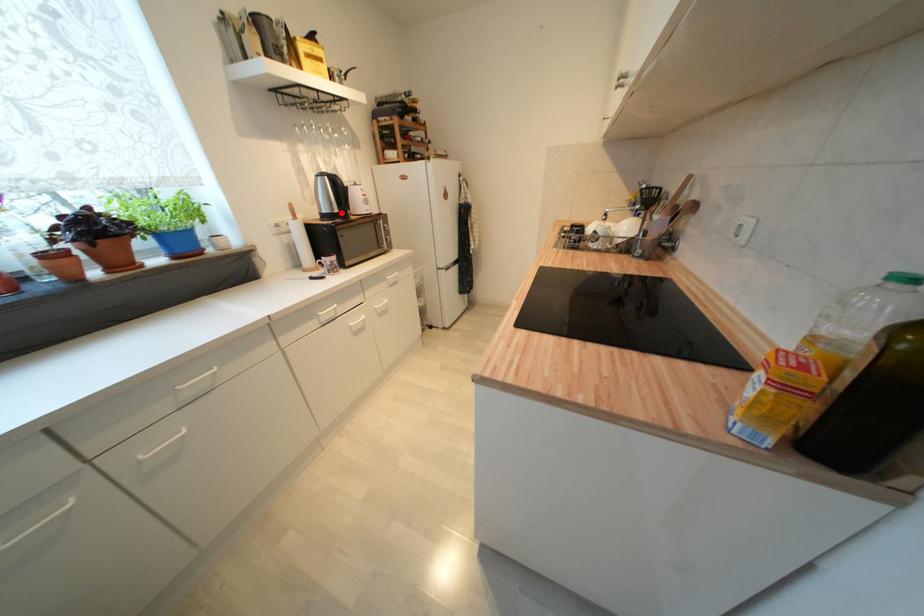
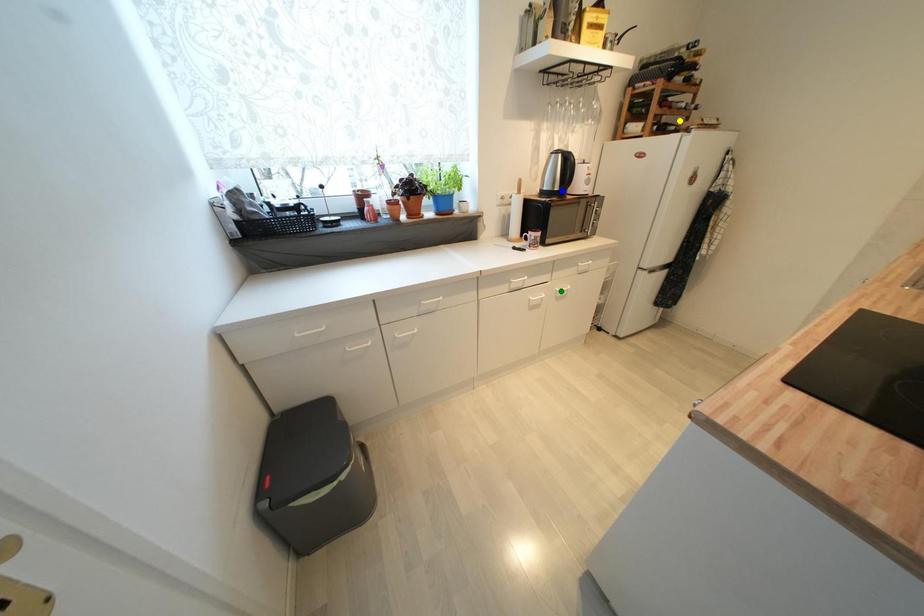
Question: I am providing you with two images of the same scene from different viewpoints. A red point is marked on the first image. You are given multiple points on the second image. In image 2, which mark is for the same physical point as the one in image 1?

Choices:
 (A) green point
 (B) blue point
 (C) yellow point

Answer: (B)